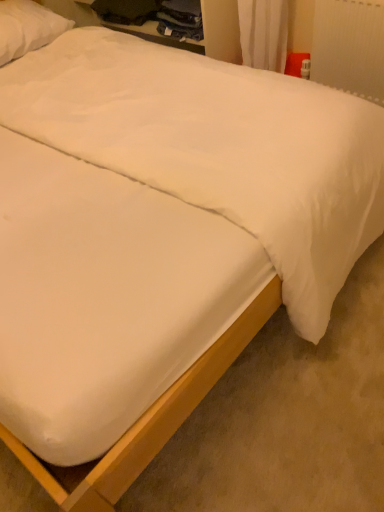
Question: Considering the relative sizes of white smooth mattress at center and white soft pillow at upper left in the image provided, is white smooth mattress at center wider than white soft pillow at upper left?

Choices:
 (A) no
 (B) yes

Answer: (B)

Question: Is white soft pillow at upper left inside white smooth mattress at center?

Choices:
 (A) yes
 (B) no

Answer: (B)

Question: Is white smooth mattress at center not within white soft pillow at upper left?

Choices:
 (A) no
 (B) yes

Answer: (B)

Question: Does white smooth mattress at center have a lesser height compared to white soft pillow at upper left?

Choices:
 (A) no
 (B) yes

Answer: (B)

Question: Can you confirm if white smooth mattress at center is thinner than white soft pillow at upper left?

Choices:
 (A) no
 (B) yes

Answer: (A)

Question: In terms of height, does white plastic radiator at upper right look taller or shorter compared to white soft pillow at upper left?

Choices:
 (A) tall
 (B) short

Answer: (A)

Question: Is white plastic radiator at upper right inside or outside of white soft pillow at upper left?

Choices:
 (A) inside
 (B) outside

Answer: (B)

Question: Is white plastic radiator at upper right to the left or to the right of white soft pillow at upper left in the image?

Choices:
 (A) right
 (B) left

Answer: (A)

Question: From a real-world perspective, is white plastic radiator at upper right positioned above or below white soft pillow at upper left?

Choices:
 (A) below
 (B) above

Answer: (A)

Question: Visually, is white soft pillow at upper left positioned to the left or to the right of white plastic radiator at upper right?

Choices:
 (A) right
 (B) left

Answer: (B)

Question: Is white soft pillow at upper left spatially inside white plastic radiator at upper right, or outside of it?

Choices:
 (A) outside
 (B) inside

Answer: (A)

Question: Does point (29, 6) appear closer or farther from the camera than point (355, 46)?

Choices:
 (A) closer
 (B) farther

Answer: (B)

Question: Is white soft pillow at upper left bigger or smaller than white plastic radiator at upper right?

Choices:
 (A) small
 (B) big

Answer: (B)

Question: From the image's perspective, is white soft pillow at upper left above or below white smooth mattress at center?

Choices:
 (A) above
 (B) below

Answer: (A)

Question: Is white soft pillow at upper left taller or shorter than white smooth mattress at center?

Choices:
 (A) tall
 (B) short

Answer: (A)